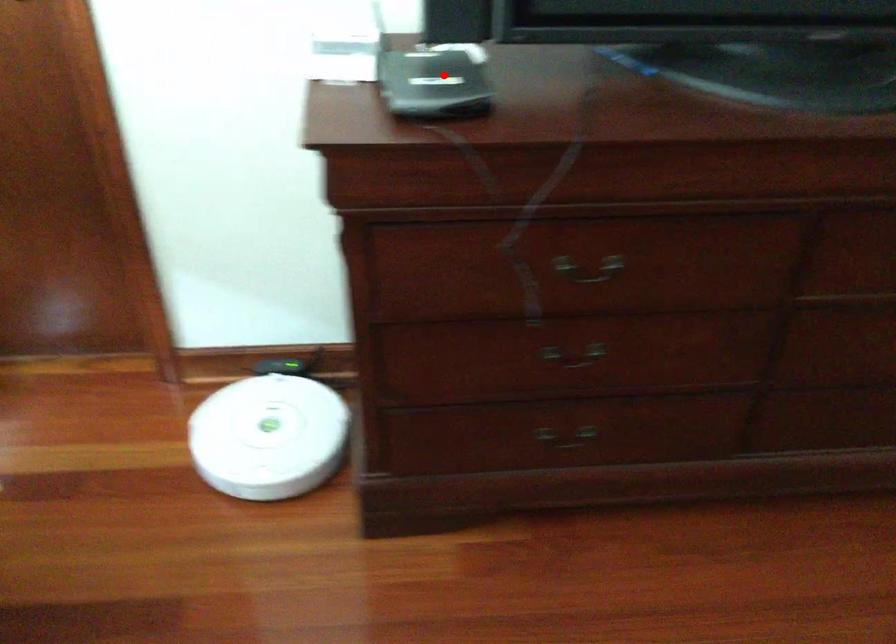
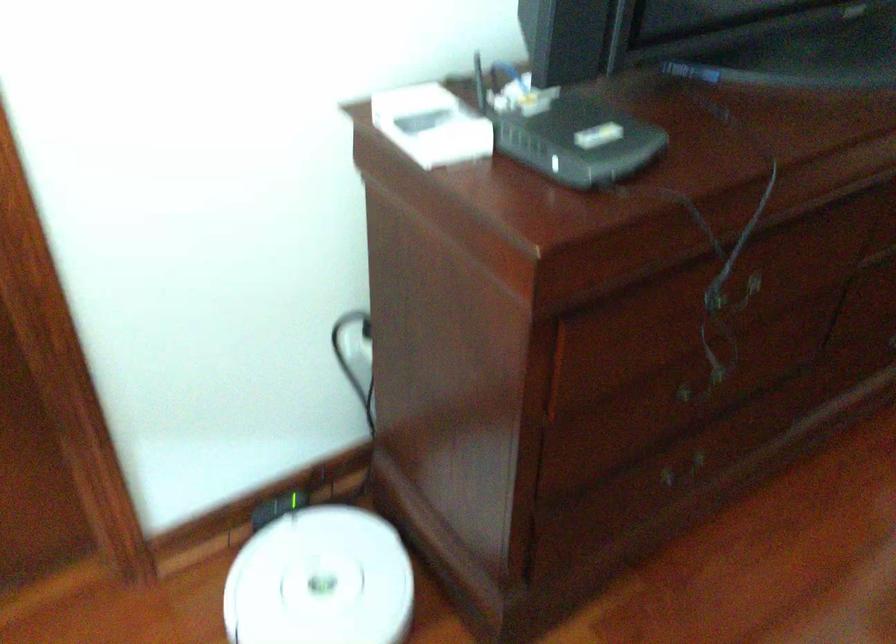
Question: I am providing you with two images of the same scene from different viewpoints. Given a red point in image1, look at the same physical point in image2. Is it:

Choices:
 (A) Closer to the viewpoint
 (B) Farther from the viewpoint

Answer: (A)